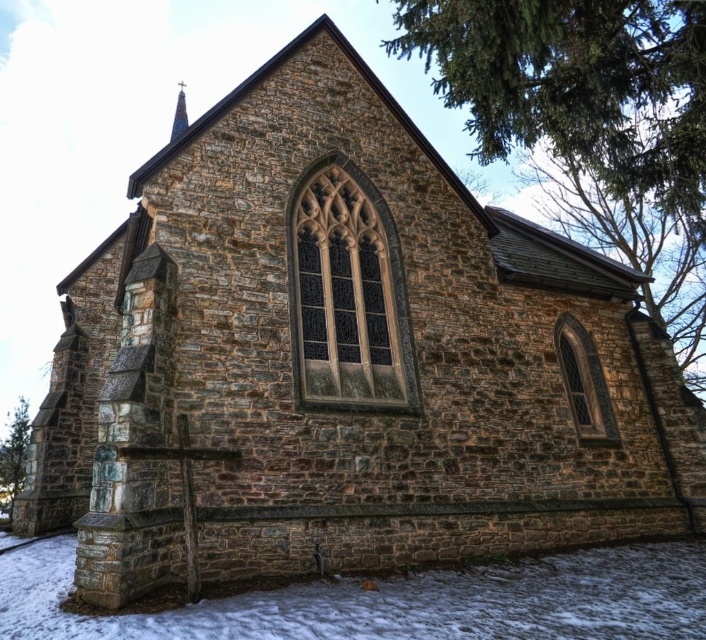
Is green leafy tree at upper right thinner than white powdery snow at lower center?

No, green leafy tree at upper right is not thinner than white powdery snow at lower center.

Based on the photo, can you confirm if green leafy tree at upper right is smaller than white powdery snow at lower center?

Actually, green leafy tree at upper right might be larger than white powdery snow at lower center.

Who is more forward, (628, 205) or (47, 618)?

Positioned in front is point (47, 618).

This screenshot has height=640, width=706. What are the coordinates of `green leafy tree at upper right` in the screenshot? It's located at click(x=590, y=122).

Is green leafy tree at upper right thinner than green leafy tree at lower left?

Incorrect, green leafy tree at upper right's width is not less than green leafy tree at lower left's.

Who is more distant from viewer, [674,145] or [8,477]?

The point [8,477] is more distant.

Does point (693, 177) come closer to viewer compared to point (5, 500)?

Yes, it is.

Locate an element on the screen. green leafy tree at upper right is located at coordinates tap(590, 122).

Does white powdery snow at lower center have a greater height compared to green leafy tree at lower left?

Incorrect, white powdery snow at lower center's height is not larger of green leafy tree at lower left's.

Does white powdery snow at lower center have a smaller size compared to green leafy tree at lower left?

Indeed, white powdery snow at lower center has a smaller size compared to green leafy tree at lower left.

Does point (299, 612) come behind point (16, 413)?

No.

Locate an element on the screen. The image size is (706, 640). white powdery snow at lower center is located at coordinates (395, 602).